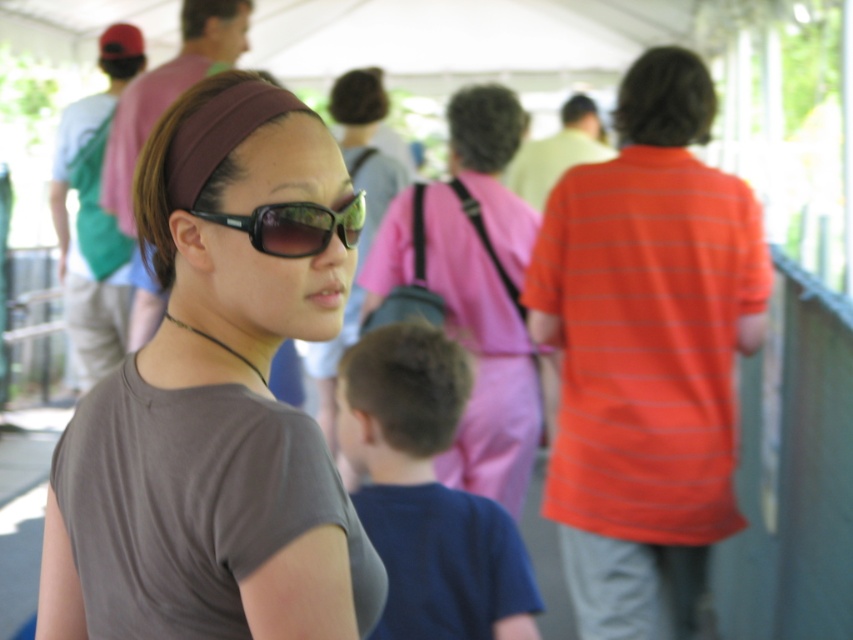
Consider the image. You are organizing a clothing donation drive and need to categorize shirts by size. You have an orange striped shirt at right and a blue cotton shirt at center. Which shirt should you place in the large size bin?

The orange striped shirt at right is larger in size than the blue cotton shirt at center, so it should be placed in the large size bin.

You are organizing a costume party and need to ensure that all accessories are appropriately sized. You have a matte brown headband at center and a blue cotton shirt at center. Which accessory has a larger width?

The matte brown headband at center has a larger width than the blue cotton shirt at center according to the description provided.